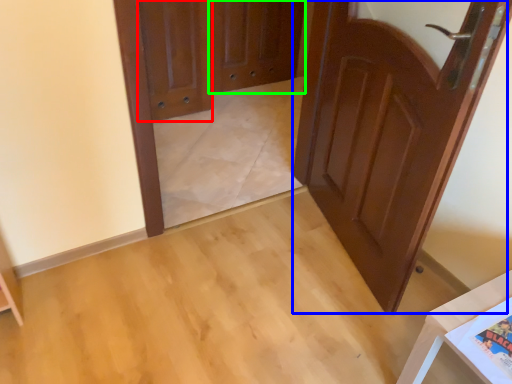
Question: Based on their relative distances, which object is nearer to door (highlighted by a red box)? Choose from door (highlighted by a blue box) and screen door (highlighted by a green box).

Choices:
 (A) door
 (B) screen door

Answer: (B)